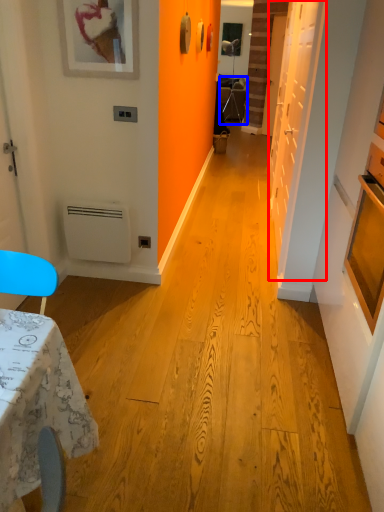
Question: Among these objects, which one is nearest to the camera, door (highlighted by a red box) or armchair (highlighted by a blue box)?

Choices:
 (A) door
 (B) armchair

Answer: (A)